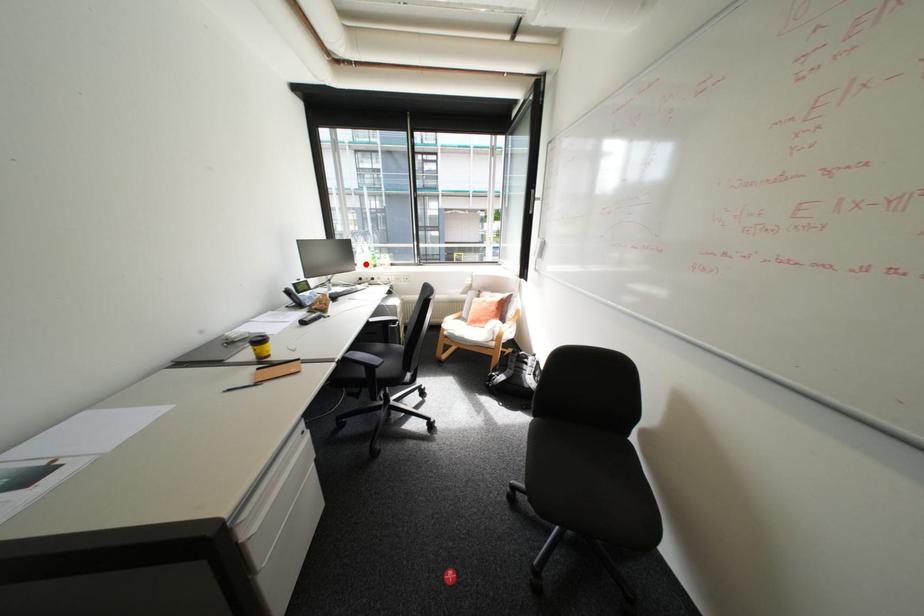
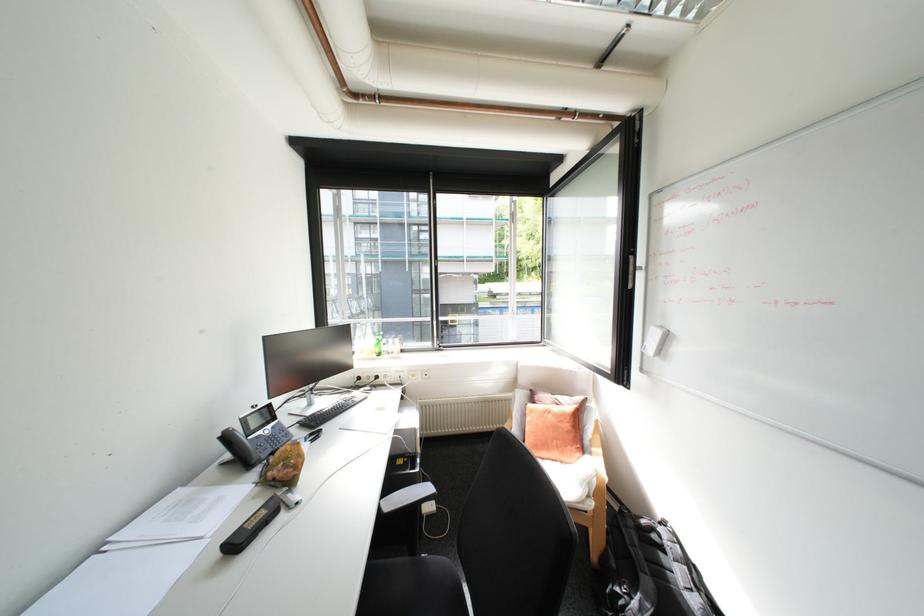
In the second image, find the point that corresponds to the highlighted location in the first image.

(362, 353)